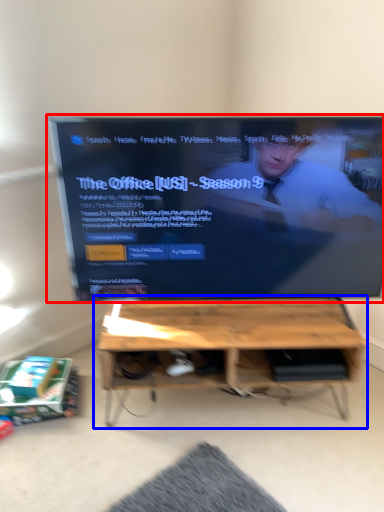
Question: Which point is closer to the camera, television (highlighted by a red box) or table (highlighted by a blue box)?

Choices:
 (A) television
 (B) table

Answer: (A)